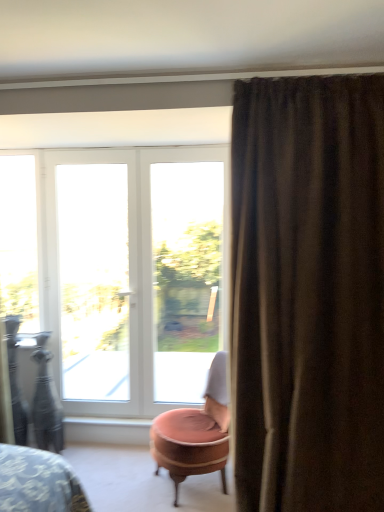
Question: Considering the relative sizes of brown textured curtain at right and white plastic window at center, which is the first window from right to left, in the image provided, is brown textured curtain at right thinner than white plastic window at center, which is the first window from right to left,?

Choices:
 (A) yes
 (B) no

Answer: (B)

Question: Does brown textured curtain at right have a greater height compared to white plastic window at center, which is the first window from right to left?

Choices:
 (A) yes
 (B) no

Answer: (A)

Question: Is brown textured curtain at right positioned in front of white plastic window at center, which is the first window from right to left?

Choices:
 (A) yes
 (B) no

Answer: (A)

Question: Considering the relative sizes of brown textured curtain at right and white plastic window at center, which is the first window from right to left, in the image provided, is brown textured curtain at right smaller than white plastic window at center, which is the first window from right to left,?

Choices:
 (A) no
 (B) yes

Answer: (A)

Question: Considering the relative positions of brown textured curtain at right and white plastic window at center, marked as the third window in a left-to-right arrangement, in the image provided, is brown textured curtain at right behind white plastic window at center, marked as the third window in a left-to-right arrangement,?

Choices:
 (A) yes
 (B) no

Answer: (B)

Question: Is white glossy window sill at lower center wider or thinner than brown textured curtain at right?

Choices:
 (A) wide
 (B) thin

Answer: (B)

Question: From the image's perspective, is white glossy window sill at lower center located above or below brown textured curtain at right?

Choices:
 (A) below
 (B) above

Answer: (A)

Question: Considering their positions, is white glossy window sill at lower center located in front of or behind brown textured curtain at right?

Choices:
 (A) behind
 (B) front

Answer: (A)

Question: From their relative heights in the image, would you say white glossy window sill at lower center is taller or shorter than brown textured curtain at right?

Choices:
 (A) tall
 (B) short

Answer: (B)

Question: From their relative heights in the image, would you say white glass door at center is taller or shorter than clear glass window at left, the 3th window in the right-to-left sequence?

Choices:
 (A) short
 (B) tall

Answer: (B)

Question: From a real-world perspective, is white glass door at center physically located above or below clear glass window at left, the first window viewed from the left?

Choices:
 (A) below
 (B) above

Answer: (A)

Question: From the image's perspective, relative to clear glass window at left, the 3th window in the right-to-left sequence, is white glass door at center above or below?

Choices:
 (A) above
 (B) below

Answer: (B)

Question: Considering the positions of white glass door at center and clear glass window at left, the first window viewed from the left, in the image, is white glass door at center wider or thinner than clear glass window at left, the first window viewed from the left,?

Choices:
 (A) wide
 (B) thin

Answer: (B)

Question: Does point (34, 330) appear closer or farther from the camera than point (165, 348)?

Choices:
 (A) farther
 (B) closer

Answer: (B)

Question: Would you say clear glass window at left, the 3th window in the right-to-left sequence, is to the left or to the right of white plastic window at center, which is the first window from right to left, in the picture?

Choices:
 (A) right
 (B) left

Answer: (B)